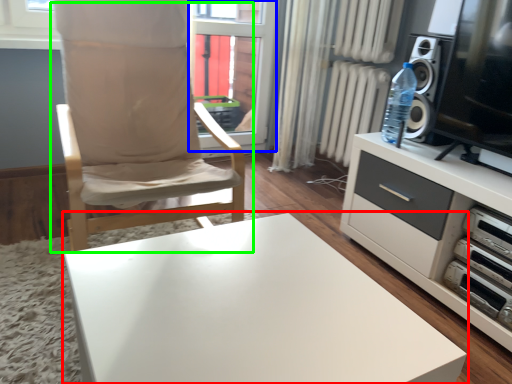
Question: Estimate the real-world distances between objects in this image. Which object is closer to table (highlighted by a red box), window screen (highlighted by a blue box) or chair (highlighted by a green box)?

Choices:
 (A) window screen
 (B) chair

Answer: (B)